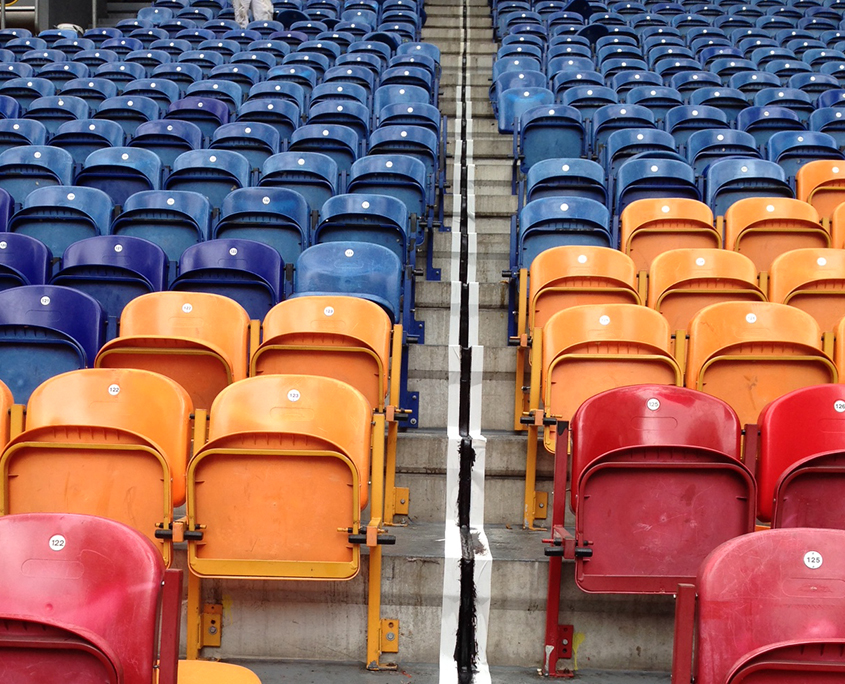
Identify the location of red chair. (84, 591), (783, 477), (690, 505), (742, 586).